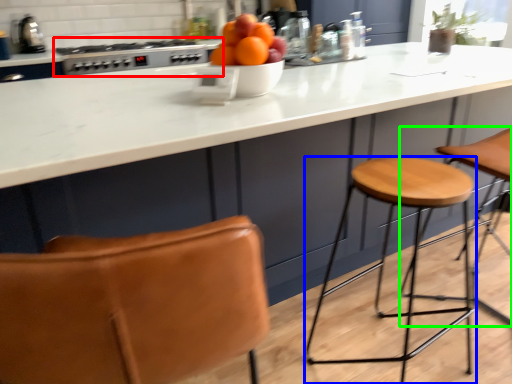
Question: Estimate the real-world distances between objects in this image. Which object is farther from gas stove (highlighted by a red box), stool (highlighted by a blue box) or step stool (highlighted by a green box)?

Choices:
 (A) stool
 (B) step stool

Answer: (B)